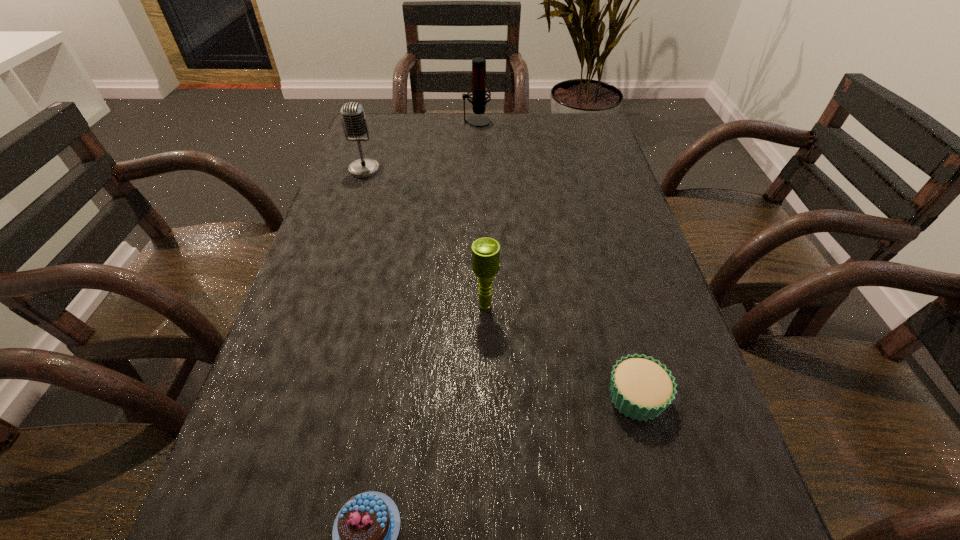
The height and width of the screenshot is (540, 960). In order to click on object positioned at the far edge in this screenshot , I will do `click(479, 91)`.

At what (x,y) coordinates should I click in order to perform the action: click on object that is at the left edge. Please return your answer as a coordinate pair (x, y). The image size is (960, 540). Looking at the image, I should click on (354, 122).

Locate an element on the screen. object that is at the right edge is located at coordinates (642, 388).

The width and height of the screenshot is (960, 540). What are the coordinates of `free space at the far edge` in the screenshot? It's located at (489, 114).

The height and width of the screenshot is (540, 960). Identify the location of vacant space at the left edge of the desktop. [x=317, y=359].

Where is `free space at the right edge`? free space at the right edge is located at coordinates (749, 520).

The width and height of the screenshot is (960, 540). What are the coordinates of `vacant area at the far right corner of the desktop` in the screenshot? It's located at (560, 146).

Locate an element on the screen. free spot between the nearest microphone and the farthest object is located at coordinates (481, 214).

Locate an element on the screen. This screenshot has width=960, height=540. free space between the farthest microphone and the nearest microphone is located at coordinates tap(481, 214).

Locate an element on the screen. free space between the farthest object and the nearest microphone is located at coordinates (481, 214).